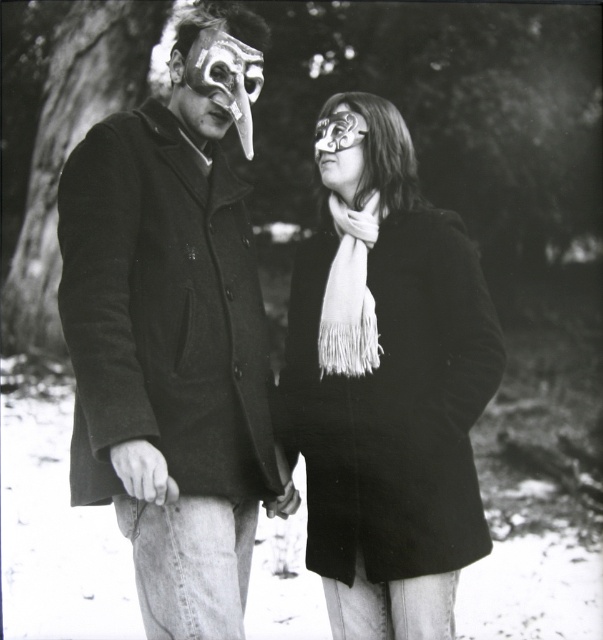
You are a photographer standing at the camera position. You want to take a closeup shot of the matte black coat at center. Given that your camera has a minimum focusing distance of 2 meters, will you be able to take the photo without moving closer?

The distance between the matte black coat at center and the camera is 2.89 meters, which is greater than the minimum focusing distance of 2 meters. Therefore, you can take the closeup shot without moving closer.

You are a photographer trying to capture a group photo of the two people in the snowy scene. The photographer needs to ensure that both individuals are in focus. Given that the camera has a depth of field that can sharply focus subjects within a 2.5 meter range, will both the white fringed scarf at center and the other person be in focus?

The two individuals are 3.00 meters apart. Since the camera can only focus within a 2.5 meter range, the distance between them exceeds the depth of field. Therefore, both the white fringed scarf at center and the other person cannot be in focus simultaneously.